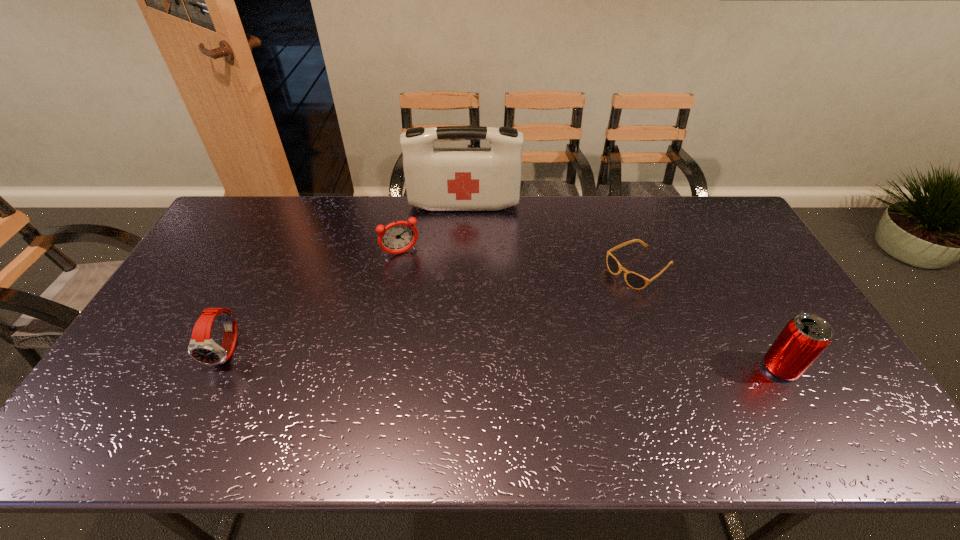
Locate an element on the screen. Image resolution: width=960 pixels, height=540 pixels. vacant space located 0.200m on the front-facing side of the shortest object is located at coordinates (570, 313).

Where is `free region located on the front-facing side of the shortest object`? The height and width of the screenshot is (540, 960). free region located on the front-facing side of the shortest object is located at coordinates (555, 322).

Identify the location of vacant position located 0.310m on the front-facing side of the shortest object. The height and width of the screenshot is (540, 960). (541, 330).

Find the location of a particular element. The height and width of the screenshot is (540, 960). free space located 0.370m on the front-facing side of the alarm clock is located at coordinates (444, 345).

Find the location of `vacant area located on the front-facing side of the alarm clock`. vacant area located on the front-facing side of the alarm clock is located at coordinates (423, 298).

In order to click on vacant region located on the front-facing side of the alarm clock in this screenshot , I will do `click(413, 272)`.

The height and width of the screenshot is (540, 960). I want to click on free region located on the front side of the farthest object, so click(463, 263).

Identify the location of vacant space located on the front side of the farthest object. Image resolution: width=960 pixels, height=540 pixels. (463, 251).

Where is `free space located 0.230m on the front side of the farthest object`? This screenshot has height=540, width=960. free space located 0.230m on the front side of the farthest object is located at coordinates (463, 255).

Where is `object that is positioned at the far edge`? This screenshot has width=960, height=540. object that is positioned at the far edge is located at coordinates (437, 179).